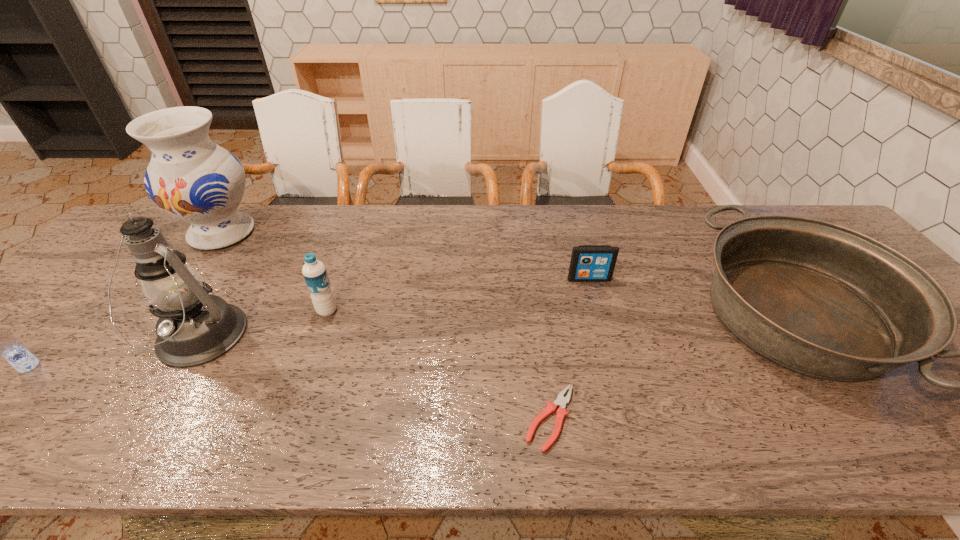
In the image, there is a desktop. At what (x,y) coordinates should I click in order to perform the action: click on blank space at the far right corner. Please return your answer as a coordinate pair (x, y). The image size is (960, 540). Looking at the image, I should click on (785, 209).

The height and width of the screenshot is (540, 960). What are the coordinates of `vacant space that's between the oil lamp and the shortest object` in the screenshot? It's located at (373, 379).

Identify the location of vacant space that is in between the shortest object and the second shortest object. The image size is (960, 540). (569, 349).

This screenshot has width=960, height=540. Identify the location of free point between the vase and the fifth object from left to right. (386, 326).

Identify the location of vacant point located between the oil lamp and the leftmost object. (113, 353).

Identify which object is the sixth closest to the rightmost object. Please provide its 2D coordinates. Your answer should be formatted as a tuple, i.e. [(x, y)], where the tuple contains the x and y coordinates of a point satisfying the conditions above.

[(0, 341)]

Identify the location of object that is the third nearest to the water bottle. The width and height of the screenshot is (960, 540). 561,401.

Identify the location of vacant space that satisfies the following two spatial constraints: 1. on the label of the shortest object; 2. on the left side of the fourth object from left to right. The image size is (960, 540). pyautogui.click(x=289, y=418).